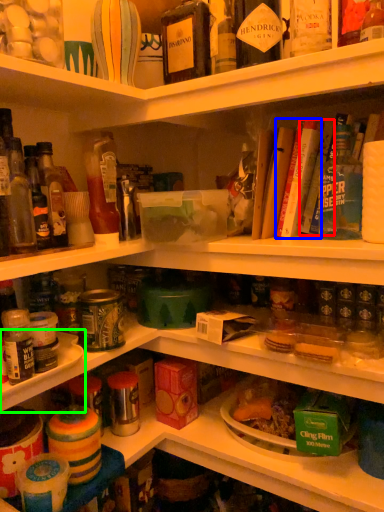
Question: Based on their relative distances, which object is farther from book (highlighted by a red box)? Choose from book (highlighted by a blue box) and shelf (highlighted by a green box).

Choices:
 (A) book
 (B) shelf

Answer: (B)